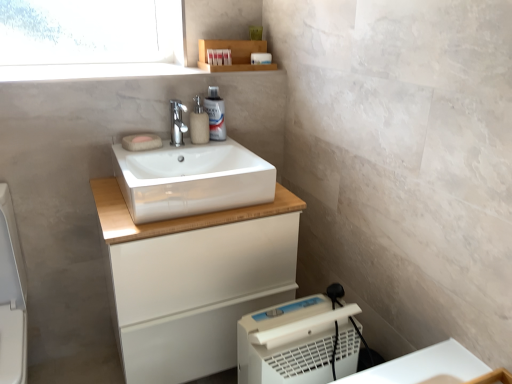
Question: Is beige fabric soap at upper center, arranged as the second soap when viewed from the back, inside or outside of matte beige soap at center, the first soap positioned from the back?

Choices:
 (A) inside
 (B) outside

Answer: (B)

Question: In terms of size, does beige fabric soap at upper center, which is the first soap from front to back, appear bigger or smaller than matte beige soap at center, the first soap positioned from the back?

Choices:
 (A) big
 (B) small

Answer: (A)

Question: Based on their relative distances, which object is nearer to the polished chrome faucet at center?

Choices:
 (A) matte beige soap at center, which is the second soap from front to back
 (B) white glossy porcelain at lower left
 (C) white glossy lotion at upper center, placed as the first toiletry when sorted from bottom to top
 (D) white glossy sink at center
 (E) white matte cabinet at center

Answer: (C)

Question: Considering the real-world distances, which object is closest to the matte beige soap at center, which is the second soap from front to back?

Choices:
 (A) white glossy lotion at upper center, placed as the first toiletry when sorted from bottom to top
 (B) white glossy porcelain at lower left
 (C) matte plastic container at upper center, which is the third toiletry in top-to-bottom order
 (D) white plastic dehumidifier at lower right
 (E) white plastic container at upper center, the 4th toiletry when ordered from bottom to top

Answer: (A)